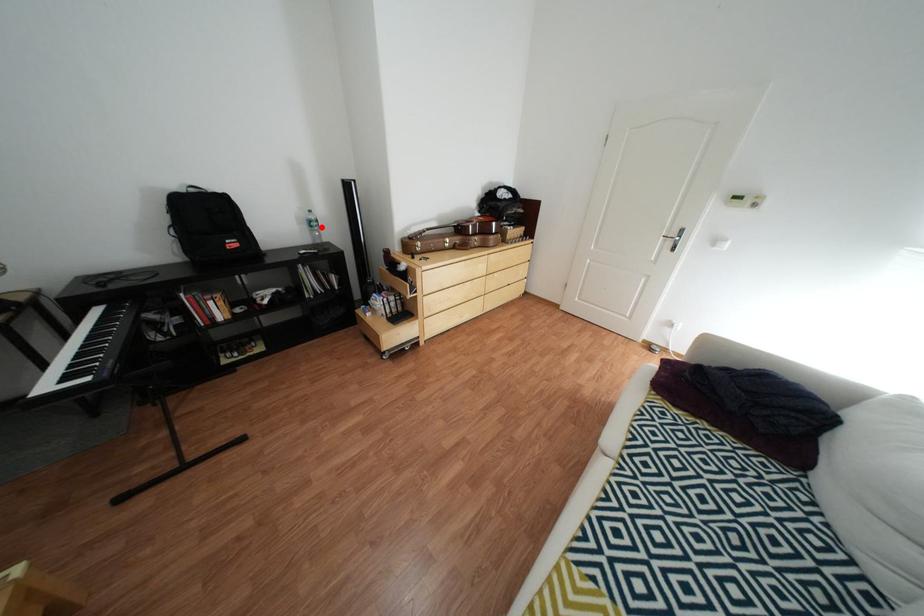
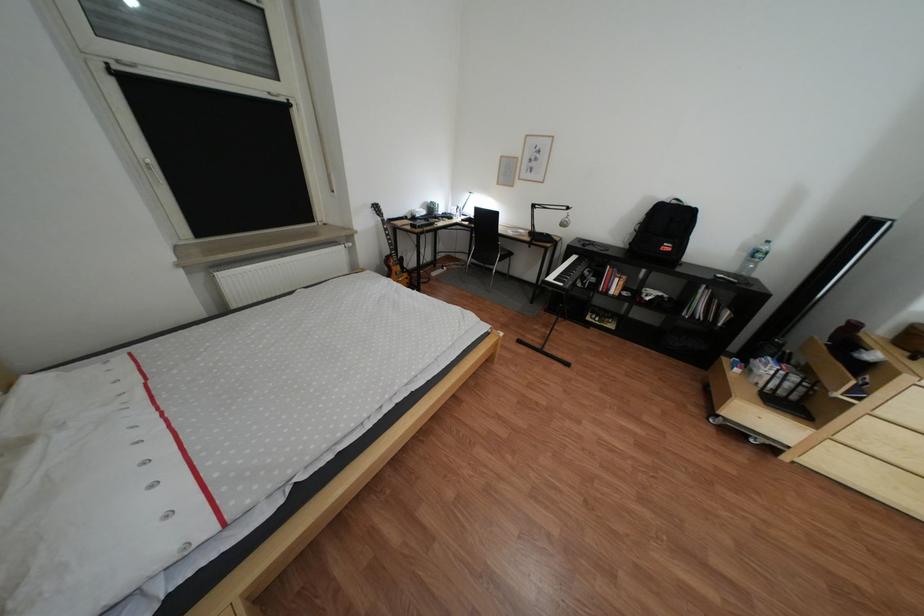
Question: A red point is marked in image1. In image2, is the corresponding 3D point closer to the camera or farther? Reply with the corresponding letter.

Choices:
 (A) The corresponding 3D point is closer.
 (B) The corresponding 3D point is farther.

Answer: (B)